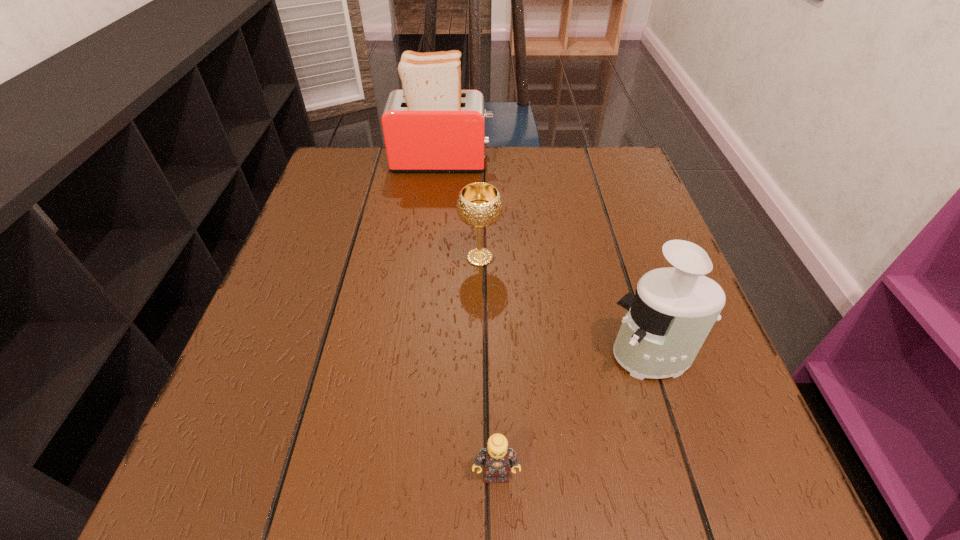
Image resolution: width=960 pixels, height=540 pixels. Find the location of `the farthest object`. the farthest object is located at coordinates (431, 125).

This screenshot has height=540, width=960. In order to click on the second nearest object in this screenshot , I will do `click(667, 321)`.

At what (x,y) coordinates should I click in order to perform the action: click on the rightmost object. Please return your answer as a coordinate pair (x, y). The width and height of the screenshot is (960, 540). Looking at the image, I should click on (667, 321).

Where is `the second shortest object`? The height and width of the screenshot is (540, 960). the second shortest object is located at coordinates (479, 205).

The image size is (960, 540). What are the coordinates of `chalice` in the screenshot? It's located at (479, 205).

This screenshot has height=540, width=960. Find the location of `Lego`. Lego is located at coordinates (497, 458).

At what (x,y) coordinates should I click in order to perform the action: click on the nearest object. Please return your answer as a coordinate pair (x, y). The height and width of the screenshot is (540, 960). Looking at the image, I should click on (497, 458).

The image size is (960, 540). I want to click on blank space located 0.200m on the front-facing side of the farthest object, so click(568, 161).

Locate an element on the screen. The image size is (960, 540). vacant region located 0.210m on the left of the second nearest object is located at coordinates (481, 356).

Locate an element on the screen. The image size is (960, 540). free space located on the front of the third tallest object is located at coordinates (480, 348).